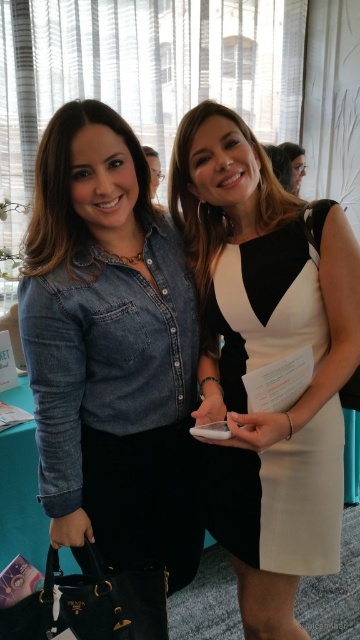
Question: From the image, what is the correct spatial relationship of denim shirt at left in relation to white matte dress at center?

Choices:
 (A) left
 (B) right

Answer: (A)

Question: Which point is farther to the camera?

Choices:
 (A) denim shirt at left
 (B) white matte dress at center

Answer: (B)

Question: Which point is farther to the camera?

Choices:
 (A) white matte dress at center
 (B) denim shirt at left

Answer: (A)

Question: Does denim shirt at left have a smaller size compared to white matte dress at center?

Choices:
 (A) no
 (B) yes

Answer: (A)

Question: Which object appears farthest from the camera in this image?

Choices:
 (A) denim shirt at left
 (B) white matte dress at center

Answer: (B)

Question: Is denim shirt at left closer to the viewer compared to white matte dress at center?

Choices:
 (A) yes
 (B) no

Answer: (A)